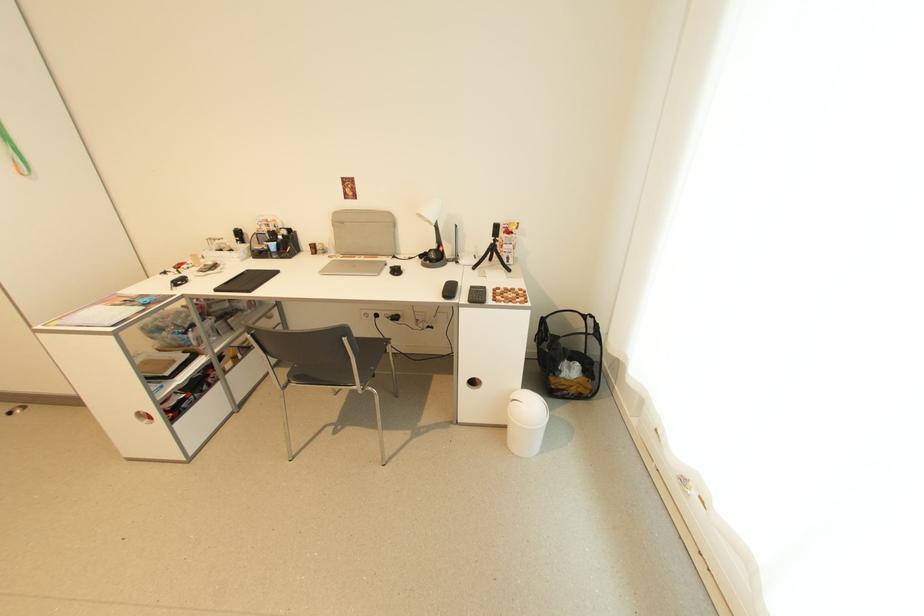
Where would you lift the black laundry basket? Please return your answer as a coordinate pair (x, y).

(569, 354)